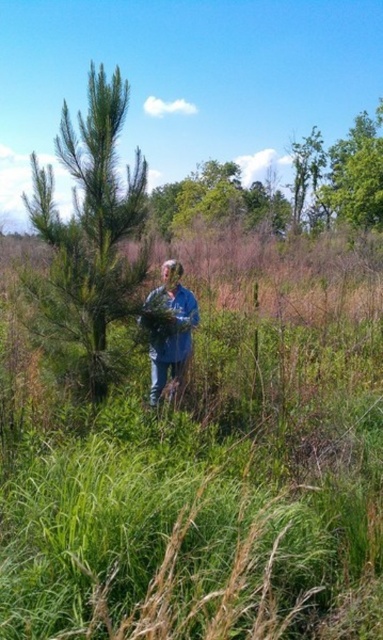
You are a hiker trying to locate a green leafy tree at upper right in the image. The coordinates of the tree are given as point (356, 173). If the image is divided into a grid from 0 to 1 on both axes, where would you look to find the tree?

The green leafy tree at upper right is located at point (356, 173), which means it is positioned approximately 27.3 percent from the left edge and 93.2 percent from the bottom edge of the image.

You are navigating through the outdoor area shown in the image. You need to move from point A at point (40, 508) to point B at point (180, 218). Which direction should you move relative to the person in the image?

To move from point A at point (40, 508) to point B at point (180, 218), you should move towards the left and upwards relative to the person in the image since point A is in front of point B and positioned to the right.

You are standing in the outdoor scene and want to walk from the green grass at center to the green leafy tree at upper center. Which direction should you move to reach the tree?

To reach the green leafy tree at upper center from the green grass at center, you should move to the right since the green grass at center is to the left of the green leafy tree at upper center.